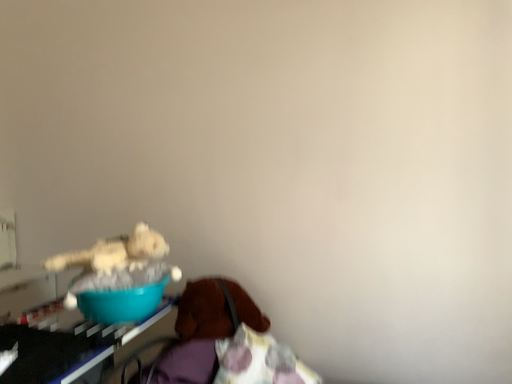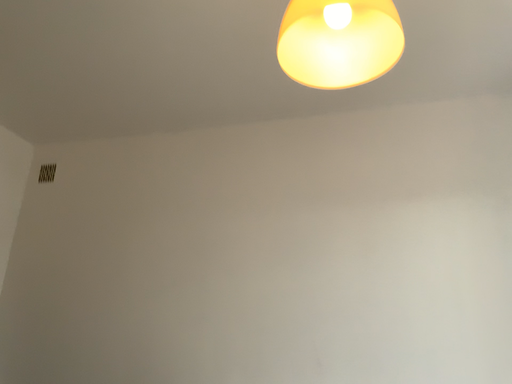
Question: Which way did the camera rotate in the video?

Choices:
 (A) rotated upward
 (B) rotated downward

Answer: (A)